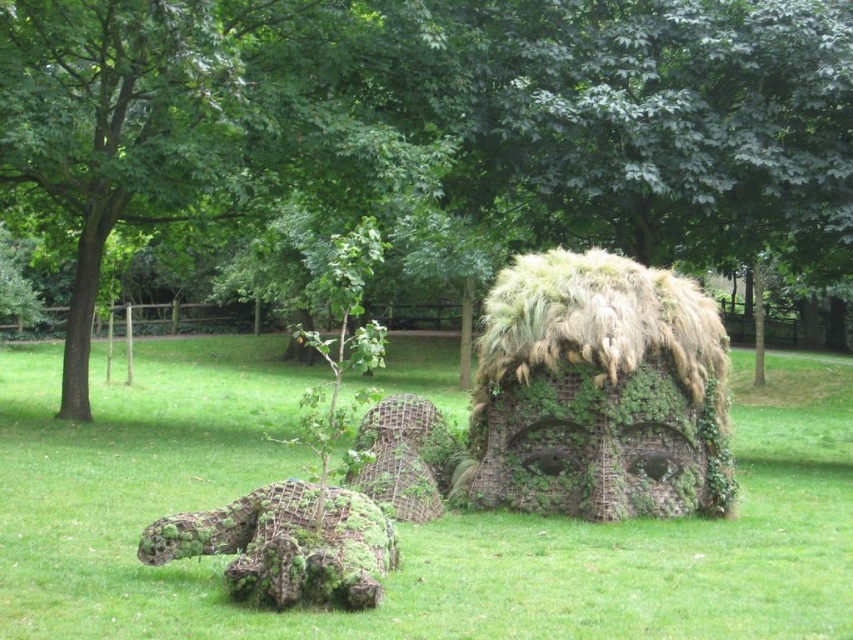
You are standing in the park and want to take a photo of both the green mossy tree at center and the green mossy sculpture at center. Which object should you position to your left to include both in the frame?

To include both the green mossy tree at center and the green mossy sculpture at center in your photo, position the green mossy tree at center to your left since it is on the right side of the sculpture. This way, both will be captured in the frame.

You are a park visitor who wants to take a photo of both the green mossy tree at center and the green mossy sculpture at center. Since you want both to be clearly visible in the frame, which object should you focus on to ensure the other is also in focus?

You should focus on the green mossy tree at center because it is larger in size than the green mossy sculpture at center, so focusing on the larger object will help ensure both are in focus.